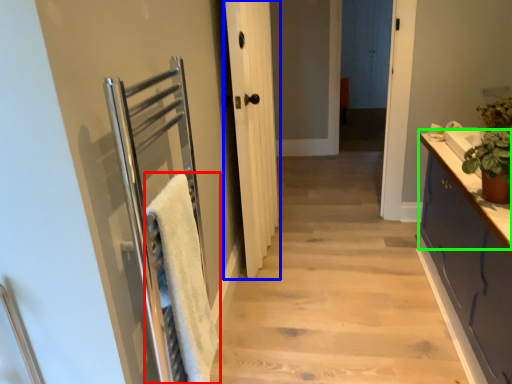
Question: Estimate the real-world distances between objects in this image. Which object is farther from bath towel (highlighted by a red box), door (highlighted by a blue box) or counter top (highlighted by a green box)?

Choices:
 (A) door
 (B) counter top

Answer: (A)